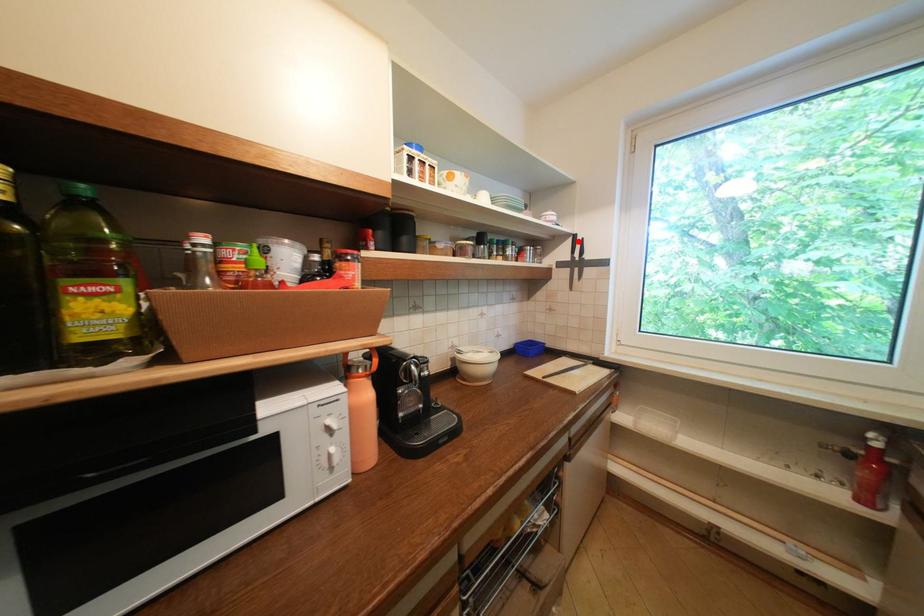
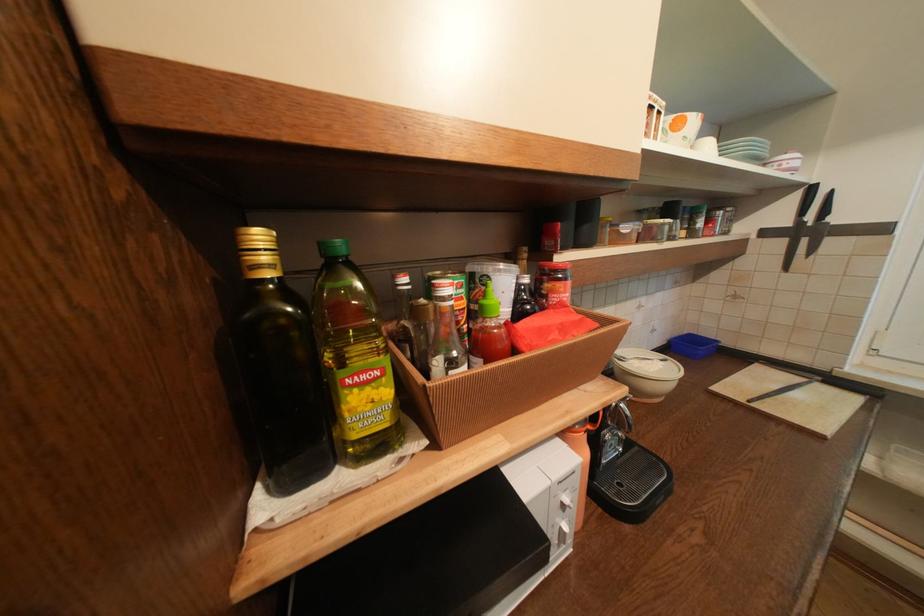
Question: I am providing you with two images of the same scene from different viewpoints. A red point is marked on the first image. Is the red point's position out of view in image 2?

Choices:
 (A) Yes
 (B) No

Answer: (B)